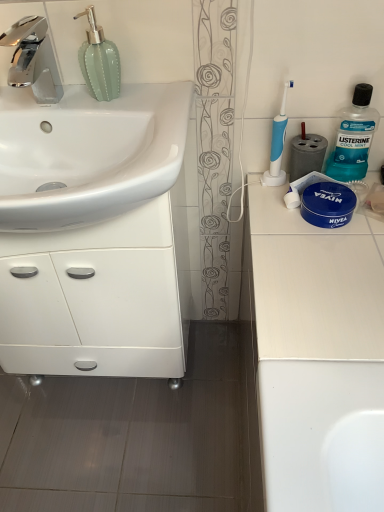
In order to click on free space in front of teal plastic mouthwash at upper right in this screenshot , I will do `click(340, 238)`.